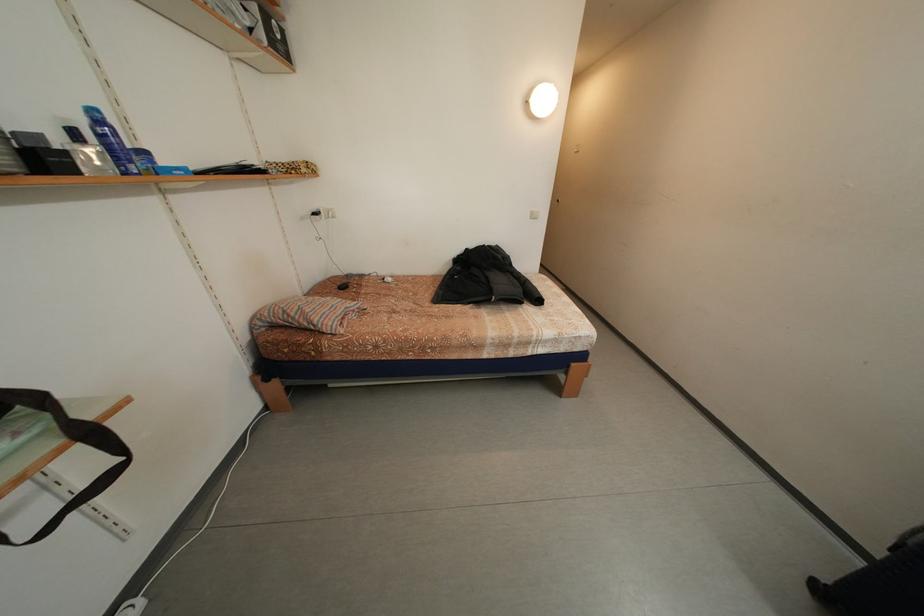
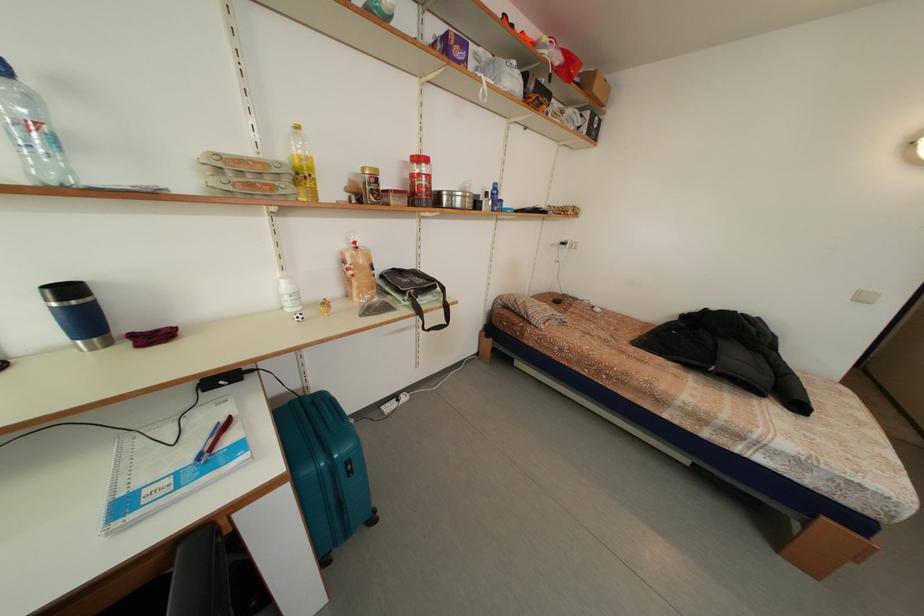
Where in the second image is the point corresponding to (540,217) from the first image?

(868, 298)